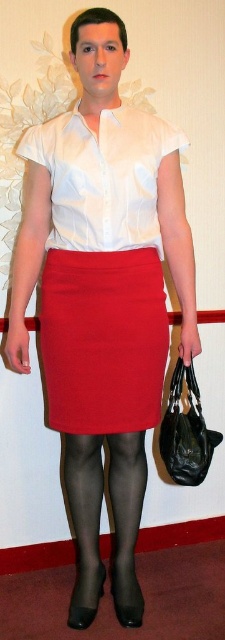
Question: Does matte red skirt at center appear over white satin blouse at upper center?

Choices:
 (A) no
 (B) yes

Answer: (A)

Question: Which is farther from the white satin blouse at upper center?

Choices:
 (A) matte red skirt at center
 (B) black sheer tights at lower center

Answer: (B)

Question: Which of the following is the farthest from the observer?

Choices:
 (A) matte red skirt at center
 (B) black sheer tights at lower center

Answer: (B)

Question: Can you confirm if white satin blouse at upper center is smaller than black sheer tights at lower center?

Choices:
 (A) no
 (B) yes

Answer: (B)

Question: Is white satin blouse at upper center thinner than black sheer tights at lower center?

Choices:
 (A) yes
 (B) no

Answer: (B)

Question: Which of the following is the farthest from the observer?

Choices:
 (A) (22, 141)
 (B) (72, 484)

Answer: (B)